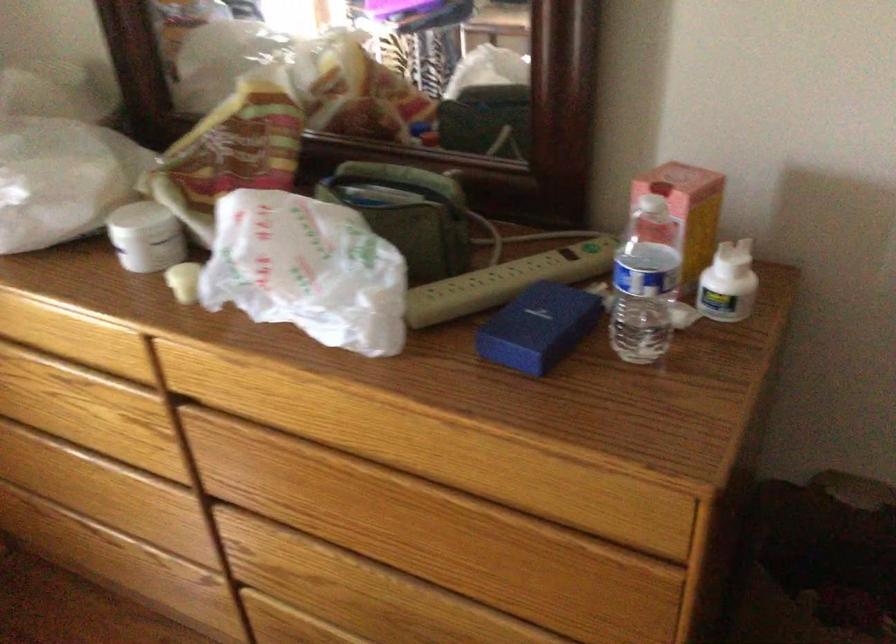
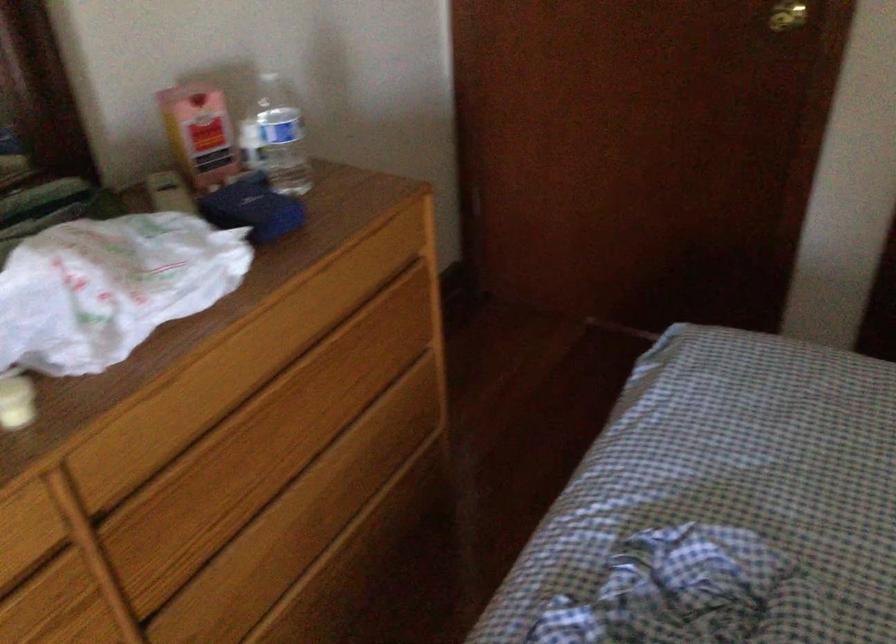
Where in the second image is the point corresponding to pixel 642 223 from the first image?

(200, 134)